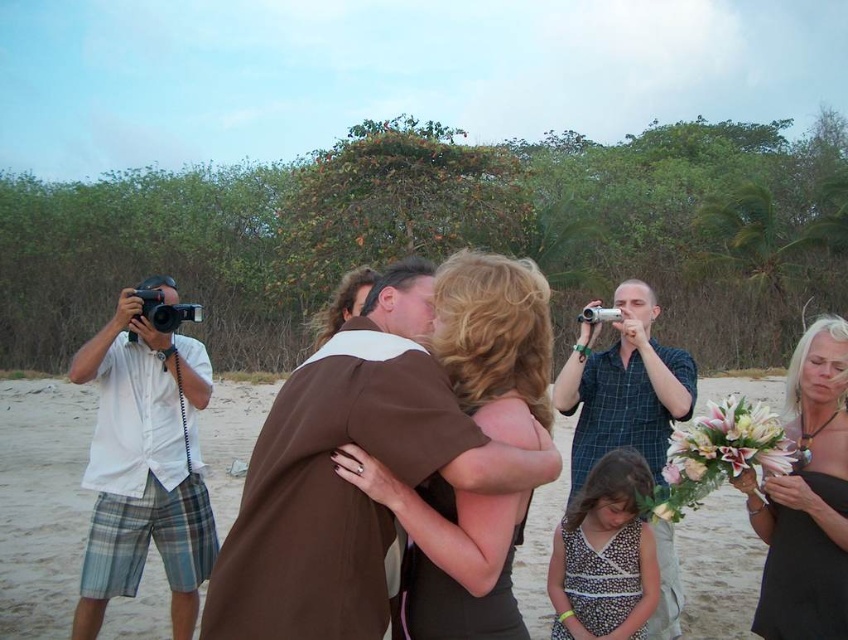
Question: Considering the relative positions of matte brown dress at center and silver metallic digital camera at center in the image provided, where is matte brown dress at center located with respect to silver metallic digital camera at center?

Choices:
 (A) above
 (B) below

Answer: (B)

Question: Does brown fabric dress at center have a greater width compared to white shirt at left?

Choices:
 (A) no
 (B) yes

Answer: (B)

Question: Which object appears closest to the camera in this image?

Choices:
 (A) matte brown dress at center
 (B) silver metallic digital camera at center
 (C) brown fabric dress at center
 (D) white shirt at left

Answer: (A)

Question: Which object is the farthest from the blue plaid shirt at center?

Choices:
 (A) polka dot dress at center
 (B) white shirt at left
 (C) white floral bouquet at right
 (D) silver metallic digital camera at center

Answer: (B)

Question: Is white shirt at left closer to camera compared to black plastic camera at left?

Choices:
 (A) yes
 (B) no

Answer: (A)

Question: Which object is farther from the camera taking this photo?

Choices:
 (A) matte brown dress at center
 (B) black satin dress at lower right
 (C) silver metallic digital camera at center
 (D) white floral bouquet at right

Answer: (C)